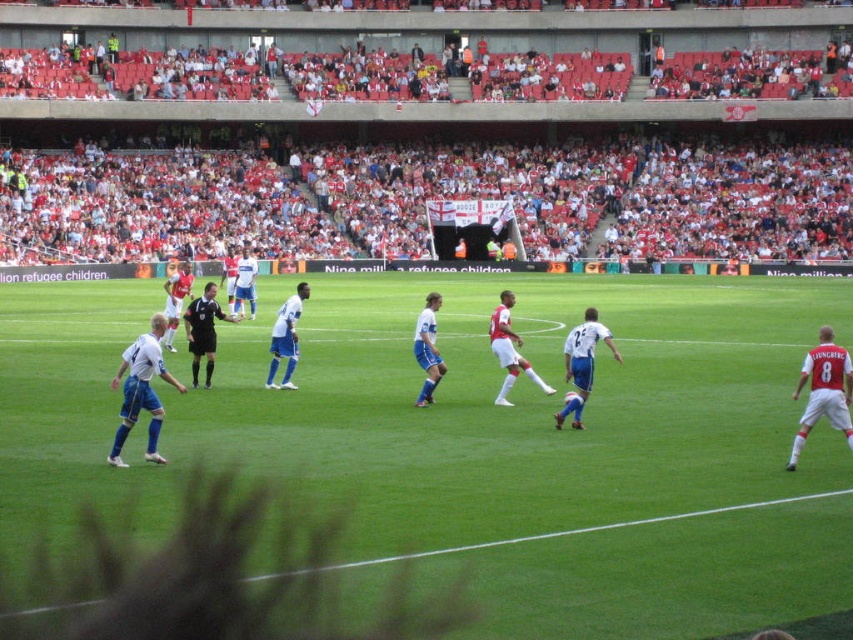
Question: Does green grass football field at center have a lesser width compared to white smooth soccer player at center?

Choices:
 (A) no
 (B) yes

Answer: (A)

Question: Which object is farther from the camera taking this photo?

Choices:
 (A) white jersey at right
 (B) white smooth soccer player at left

Answer: (B)

Question: Which point is closer to the camera?

Choices:
 (A) blue jersey at center
 (B) white smooth soccer player at left
 (C) black uniform at center
 (D) white smooth soccer player at center

Answer: (B)

Question: Which object is closer to the camera taking this photo?

Choices:
 (A) white jersey at center
 (B) green grass football field at center
 (C) black uniform at center

Answer: (B)

Question: Does black uniform at center have a lesser width compared to blue jersey at center?

Choices:
 (A) yes
 (B) no

Answer: (A)

Question: Can you confirm if white smooth soccer player at left is smaller than black uniform at center?

Choices:
 (A) no
 (B) yes

Answer: (A)